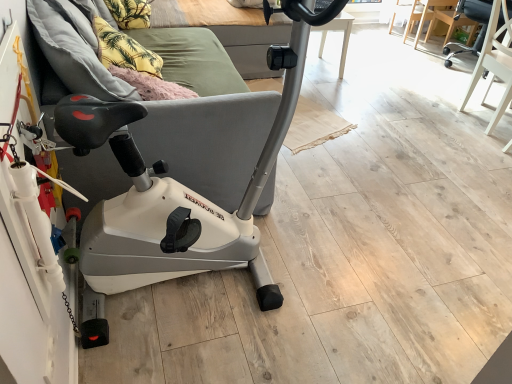
You are a GUI agent. You are given a task and a screenshot of the screen. Output one action in this format:
    pyautogui.click(x=<x>, y=<y>)
    Task: Click on the empty space that is in between white plastic stationary bicycle at left and black leather swivel chair at upper right, which is the 2th swivel chair in back-to-front order
    
    Given the screenshot: What is the action you would take?
    pyautogui.click(x=395, y=172)